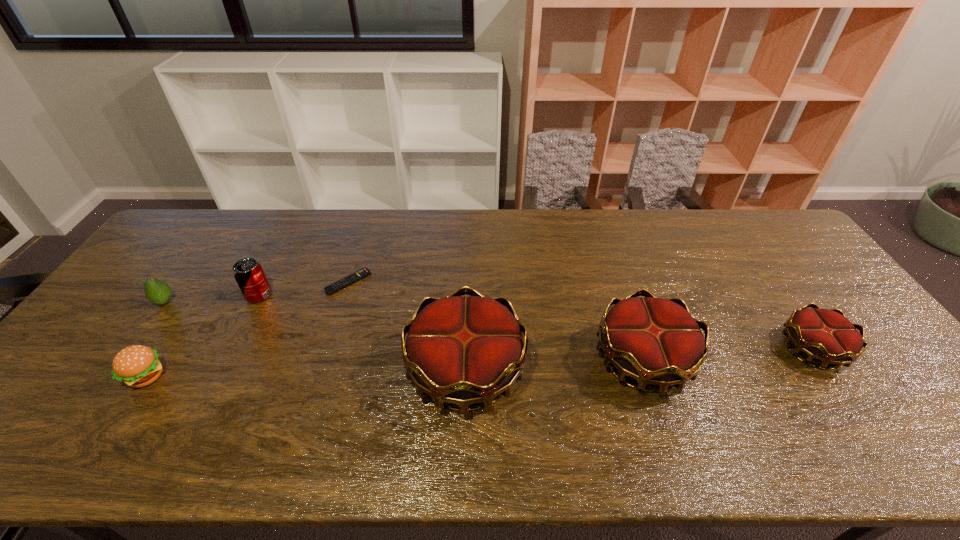
Please point out where to position a new crown on the left to maintain spacing. Please provide its 2D coordinates. Your answer should be formatted as a tuple, i.e. [(x, y)], where the tuple contains the x and y coordinates of a point satisfying the conditions above.

[(280, 382)]